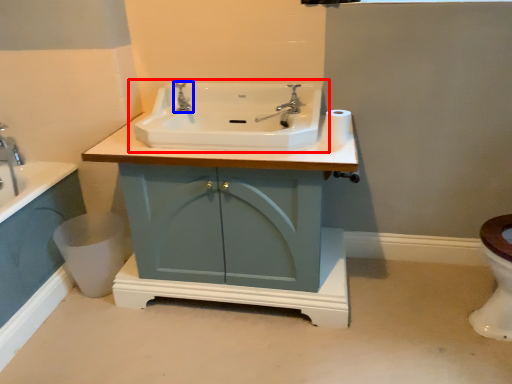
Question: Among these objects, which one is nearest to the camera, sink (highlighted by a red box) or tap (highlighted by a blue box)?

Choices:
 (A) sink
 (B) tap

Answer: (A)